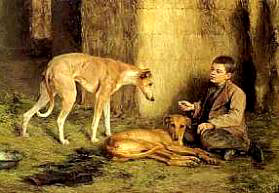
The image size is (279, 193). What are the coordinates of `floor that is darkest on the lower left` in the screenshot? It's located at (55, 178).